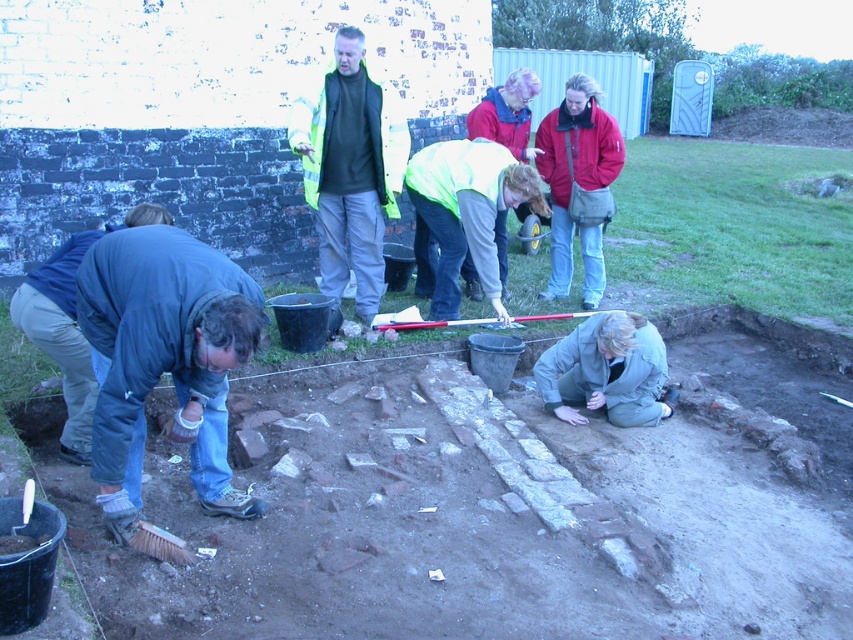
Is blue denim jeans at lower left to the right of light green reflective jacket at center from the viewer's perspective?

Incorrect, blue denim jeans at lower left is not on the right side of light green reflective jacket at center.

Who is more forward, [247,500] or [503,305]?

Positioned in front is point [247,500].

Identify the location of blue denim jeans at lower left. (163, 360).

Describe the element at coordinates (465, 216) in the screenshot. I see `light green reflective jacket at center` at that location.

From the picture: Which is more to the left, light green reflective jacket at center or red jacket at center?

light green reflective jacket at center is more to the left.

Locate an element on the screen. The height and width of the screenshot is (640, 853). light green reflective jacket at center is located at coordinates (465, 216).

You are a GUI agent. You are given a task and a screenshot of the screen. Output one action in this format:
    pyautogui.click(x=<x>, y=<y>)
    Task: Click on the light green reflective jacket at center
    Image resolution: width=853 pixels, height=640 pixels.
    Given the screenshot: What is the action you would take?
    pyautogui.click(x=465, y=216)

Which of these two, blue denim jeans at lower left or khaki fabric jacket at lower right, stands taller?

Standing taller between the two is blue denim jeans at lower left.

Is point (115, 310) positioned in front of point (641, 420)?

Yes.

I want to click on blue denim jeans at lower left, so click(163, 360).